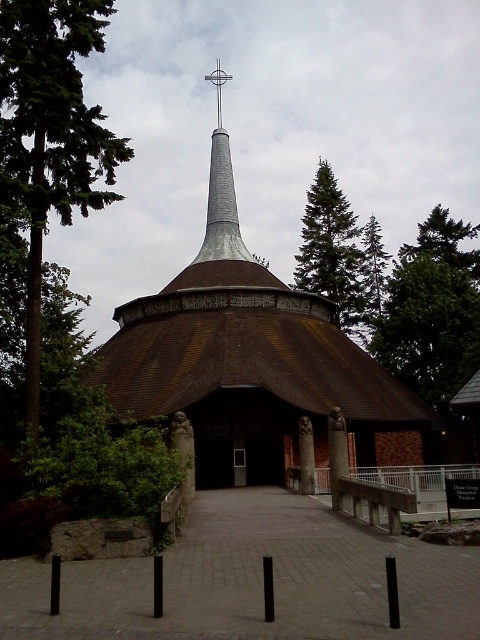
You are standing outside the brown wooden church at center and want to take a photo of it. If your camera can focus on objects up to 15 meters away, will you be able to capture a clear image of the church?

The distance between you and the brown wooden church at center is 13.79 meters, which is within the camera focus range of 15 meters. Therefore, you can capture a clear image of the church.

You are an architect evaluating the proportions of the brown wooden church at center and the silver metallic cross at upper center in the image. Which object has a greater width?

The brown wooden church at center has a greater width than the silver metallic cross at upper center according to the description.

You are an architect evaluating the design of the modern church. You notice the green textured pine tree at upper center and the silver metallic cross at upper center. Which object occupies more horizontal space in the composition?

The green textured pine tree at upper center occupies more horizontal space than the silver metallic cross at upper center because its width surpasses that of the cross.